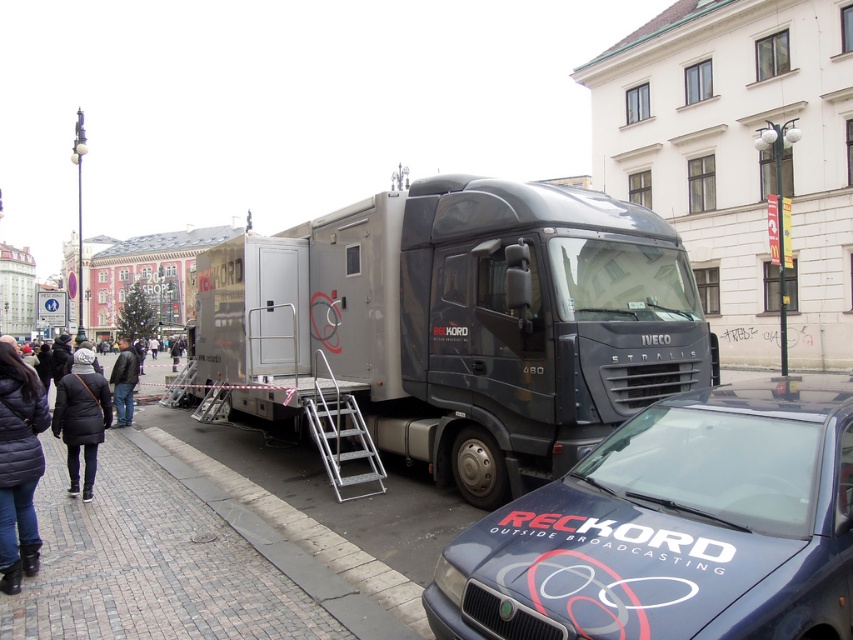
In the scene shown: You are a pedestrian standing on the sidewalk and see both the dark blue quilted jacket at lower left and the leather jacket at lower left. Which jacket is positioned higher relative to the other?

The dark blue quilted jacket at lower left is above the leather jacket at lower left, so it is positioned higher.

You are a delivery person who needs to park a new van next to the existing vehicles in the scene. The new van is exactly the same width as the leather jacket at lower left. Can the new van fit in the space between the matte black van at center and the curb?

The matte black van at center is narrower than the leather jacket at lower left. Since the new van matches the width of the leather jacket at lower left, it would be wider than the existing matte black van at center. Therefore, the new van may not fit in the space between the matte black van at center and the curb unless there is additional room available beyond the current width difference.

You are a delivery person who needs to park your 6.5 feet tall delivery van. You see the matte black van at center and the leather jacket at lower left. Which object is shorter and can accommodate your van?

The matte black van at center is shorter than the leather jacket at lower left, so it can accommodate your 6.5 feet tall delivery van.